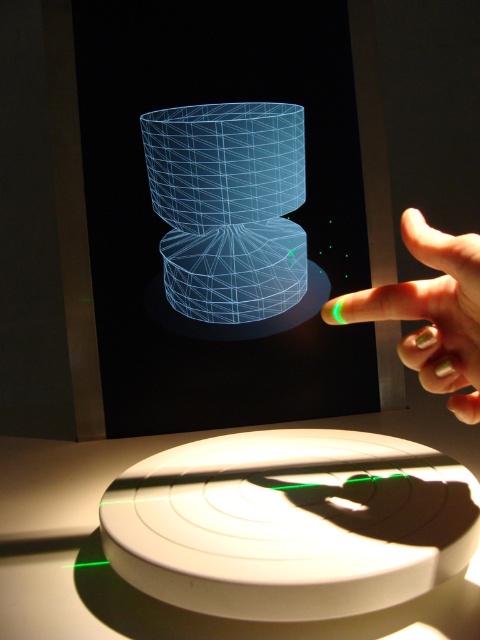
You are an engineer designing a virtual interface. You need to place the transparent wireframe cylinder at center and the green matte nail polish at upper right in a way that they are aligned horizontally. Based on the current setup, which object is on the left side when looking at them from the front?

The transparent wireframe cylinder at center is positioned on the left side of the green matte nail polish at upper right, so when looking from the front, the transparent wireframe cylinder at center is on the left.

You are an engineer designing a holographic interface. You have a transparent wireframe cylinder at center and a green matte nail polish at upper right. Which object should you prioritize for calibration if you need to adjust the projection size for the larger object?

You should prioritize calibrating the transparent wireframe cylinder at center because it is larger than the green matte nail polish at upper right.